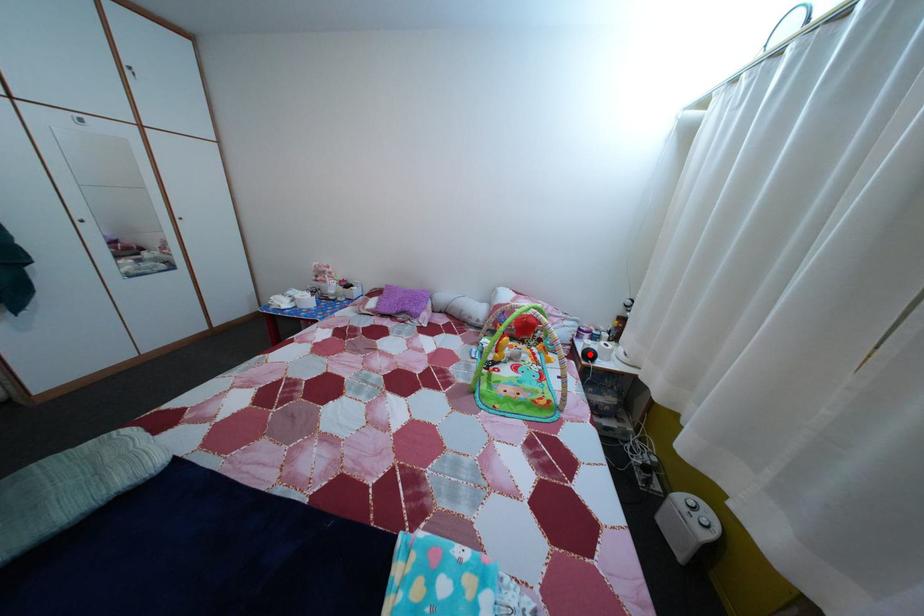
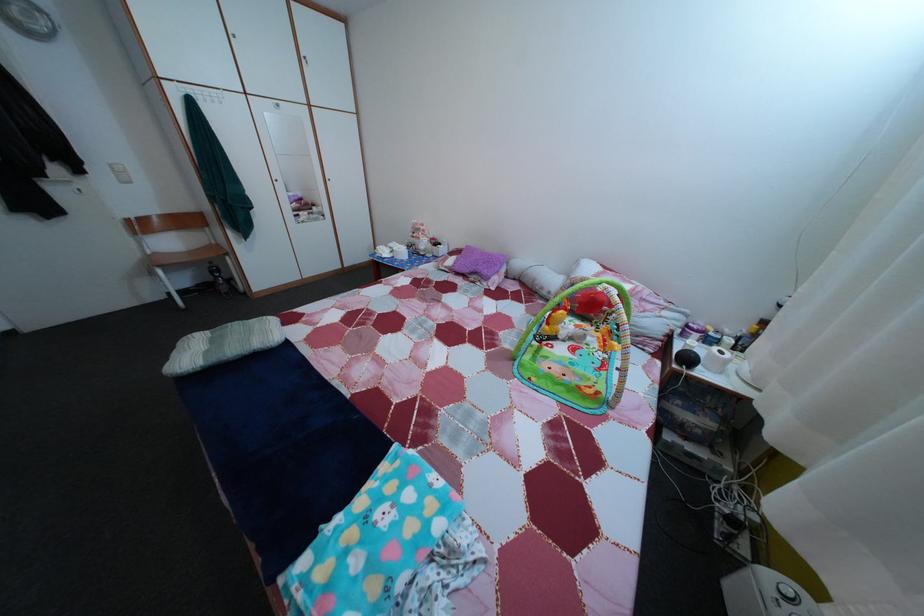
The point at the highlighted location is marked in the first image. Where is the corresponding point in the second image?

(687, 354)